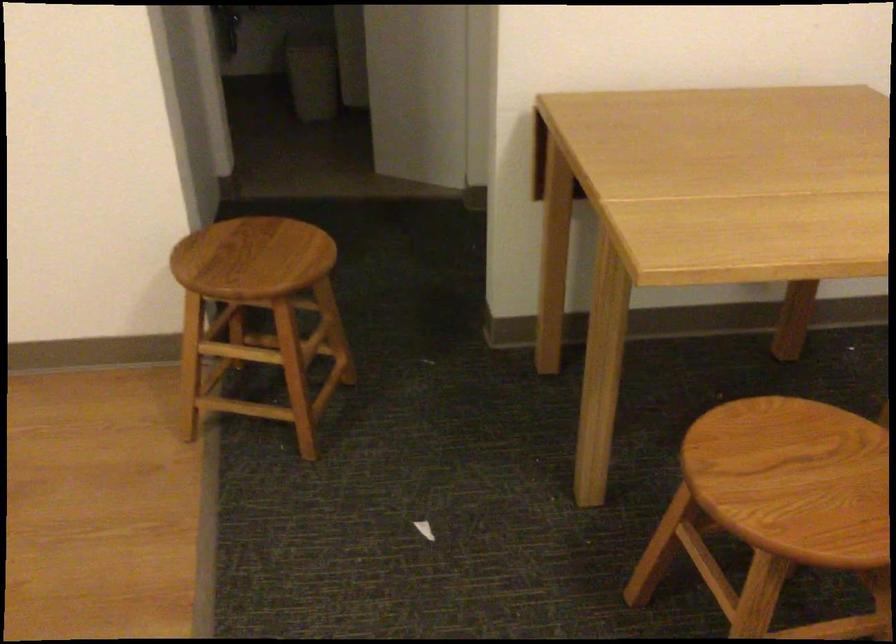
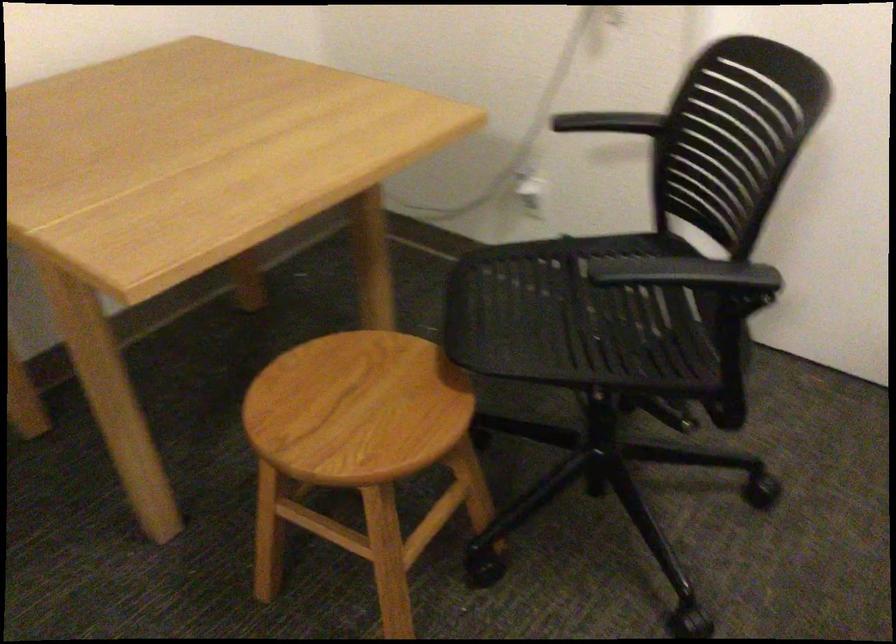
Locate, in the second image, the point that corresponds to point (800, 482) in the first image.

(356, 408)